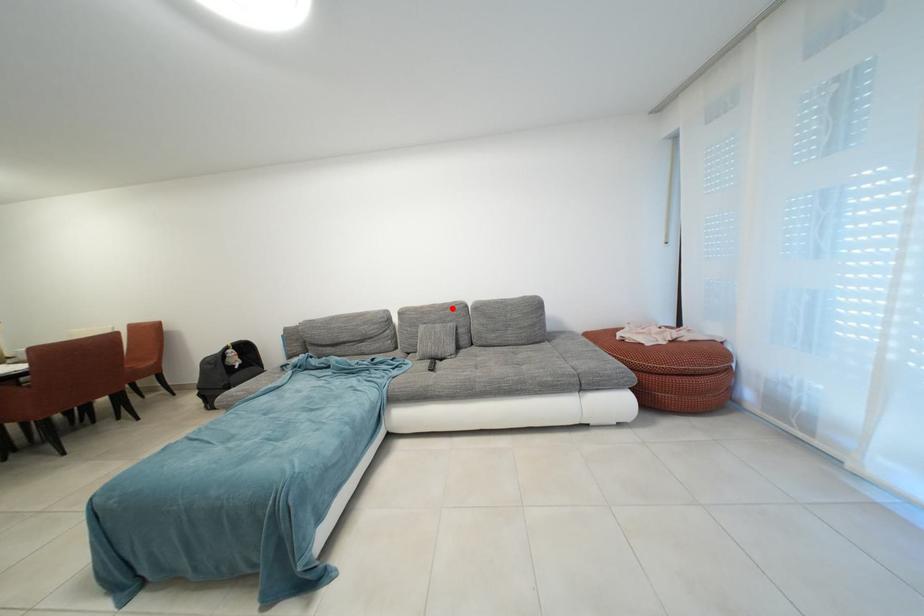
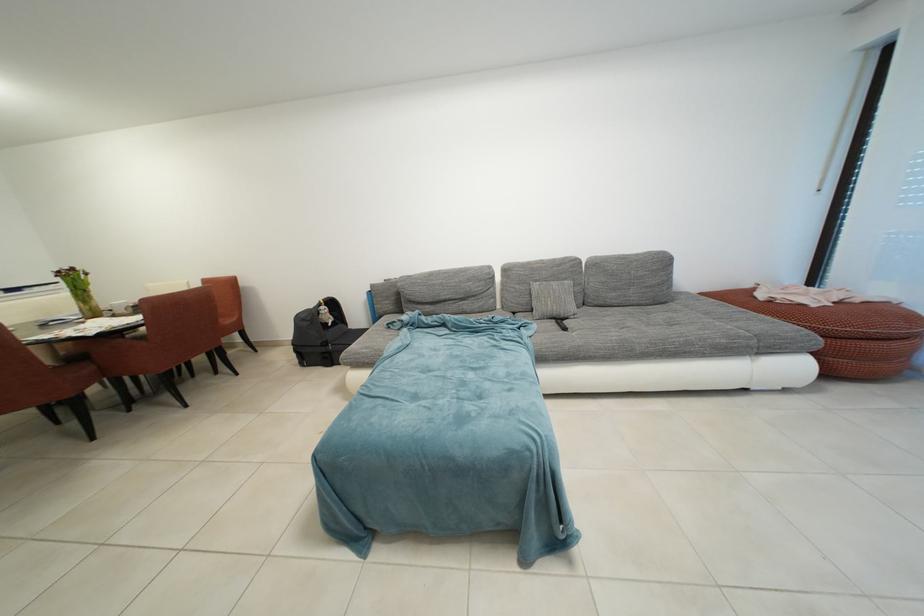
The point at the highlighted location is marked in the first image. Where is the corresponding point in the second image?

(563, 264)